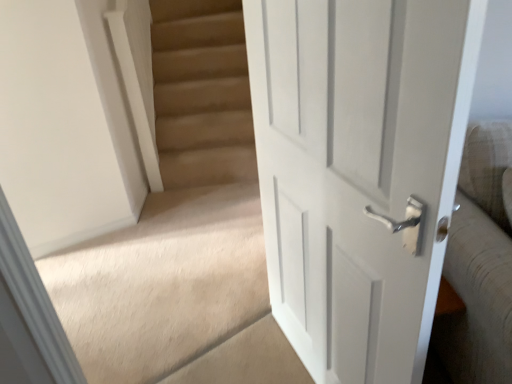
Image resolution: width=512 pixels, height=384 pixels. In order to click on carpeted stairs at center in this screenshot , I will do `click(177, 217)`.

Measure the distance between point [165,362] and camera.

5.74 feet.

The width and height of the screenshot is (512, 384). Describe the element at coordinates (177, 217) in the screenshot. I see `carpeted stairs at center` at that location.

From the picture: Measure the distance between point (301, 66) and camera.

Point (301, 66) and camera are 3.58 feet apart from each other.

What do you see at coordinates (359, 171) in the screenshot?
I see `white painted wood door at right` at bounding box center [359, 171].

Identify the location of white painted wood door at right. (359, 171).

You are a GUI agent. You are given a task and a screenshot of the screen. Output one action in this format:
    pyautogui.click(x=<x>, y=<y>)
    Task: Click on the carpeted stairs at center
    
    Given the screenshot: What is the action you would take?
    pyautogui.click(x=177, y=217)

Is carpeted stairs at center at the left side of white painted wood door at right?

Indeed, carpeted stairs at center is positioned on the left side of white painted wood door at right.

Is carpeted stairs at center closer to camera compared to white painted wood door at right?

No, carpeted stairs at center is further to the viewer.

Considering the points (175, 2) and (398, 67), which point is behind, point (175, 2) or point (398, 67)?

The point (175, 2) is farther.

From the image's perspective, is carpeted stairs at center above or below white painted wood door at right?

carpeted stairs at center is above white painted wood door at right.

From a real-world perspective, is carpeted stairs at center on white painted wood door at right?

Yes, from a real-world perspective, carpeted stairs at center is above white painted wood door at right.

Can you confirm if carpeted stairs at center is wider than white painted wood door at right?

Yes, carpeted stairs at center is wider than white painted wood door at right.

Considering the relative sizes of carpeted stairs at center and white painted wood door at right in the image provided, is carpeted stairs at center shorter than white painted wood door at right?

No.

Considering the relative sizes of carpeted stairs at center and white painted wood door at right in the image provided, is carpeted stairs at center bigger than white painted wood door at right?

Correct, carpeted stairs at center is larger in size than white painted wood door at right.

Is carpeted stairs at center inside the boundaries of white painted wood door at right, or outside?

carpeted stairs at center cannot be found inside white painted wood door at right.

Is carpeted stairs at center far away from white painted wood door at right?

carpeted stairs at center is actually quite close to white painted wood door at right.

Is carpeted stairs at center facing away from white painted wood door at right?

Yes, carpeted stairs at center is positioned with its back facing white painted wood door at right.

Can you tell me how much carpeted stairs at center and white painted wood door at right differ in facing direction?

There is a 105-degree angle between the facing directions of carpeted stairs at center and white painted wood door at right.

How distant is carpeted stairs at center from white painted wood door at right?

They are 30.99 inches apart.

Where is `door that appears below the carpeted stairs at center (from the image's perspective)`? This screenshot has width=512, height=384. door that appears below the carpeted stairs at center (from the image's perspective) is located at coordinates point(359,171).

Visually, is white painted wood door at right positioned to the left or to the right of carpeted stairs at center?

white painted wood door at right is positioned on carpeted stairs at center's right side.

Is white painted wood door at right positioned in front of carpeted stairs at center?

That is True.

Which is closer to the camera, (x=253, y=3) or (x=215, y=321)?

Clearly, point (x=253, y=3) is closer to the camera than point (x=215, y=321).

From the image's perspective, between white painted wood door at right and carpeted stairs at center, who is located below?

white painted wood door at right, from the image's perspective.

From a real-world perspective, which object rests below the other?

From a 3D spatial view, white painted wood door at right is below.

Does white painted wood door at right have a greater width compared to carpeted stairs at center?

In fact, white painted wood door at right might be narrower than carpeted stairs at center.

Is white painted wood door at right taller or shorter than carpeted stairs at center?

In the image, white painted wood door at right appears to be shorter than carpeted stairs at center.

Can you confirm if white painted wood door at right is smaller than carpeted stairs at center?

Indeed, white painted wood door at right has a smaller size compared to carpeted stairs at center.

Would you say carpeted stairs at center is part of white painted wood door at right's contents?

No, carpeted stairs at center is not surrounded by white painted wood door at right.

Is white painted wood door at right positioned far away from carpeted stairs at center?

No.

Could you tell me if white painted wood door at right is facing carpeted stairs at center?

Yes, white painted wood door at right is facing carpeted stairs at center.

The image size is (512, 384). Find the location of `stairwell above the white painted wood door at right (from the image's perspective)`. stairwell above the white painted wood door at right (from the image's perspective) is located at coordinates (177, 217).

This screenshot has width=512, height=384. Identify the location of stairwell above the white painted wood door at right (from a real-world perspective). (177, 217).

Identify the location of door that appears in front of the carpeted stairs at center. (359, 171).